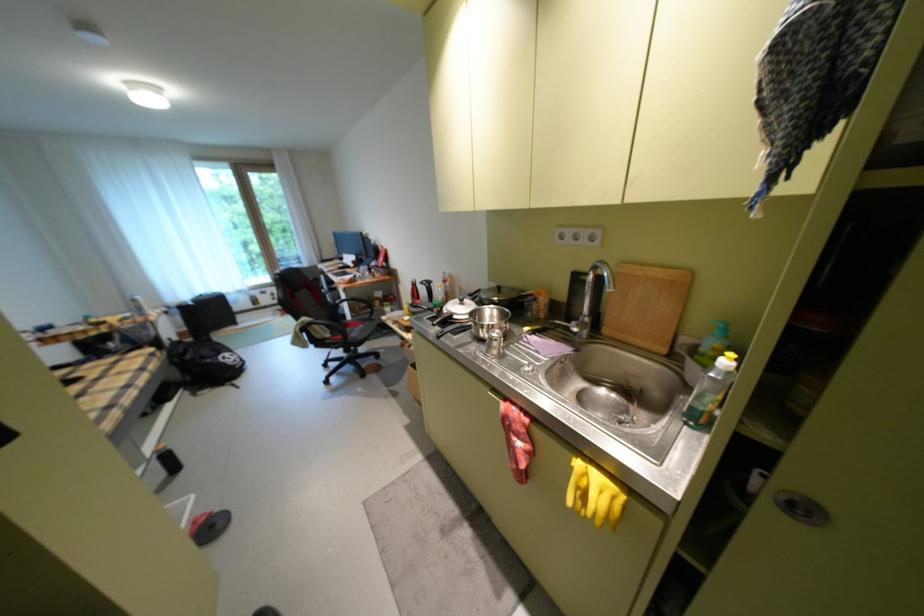
Find the location of a particular element. Image resolution: width=924 pixels, height=616 pixels. black water bottle is located at coordinates (710, 391).